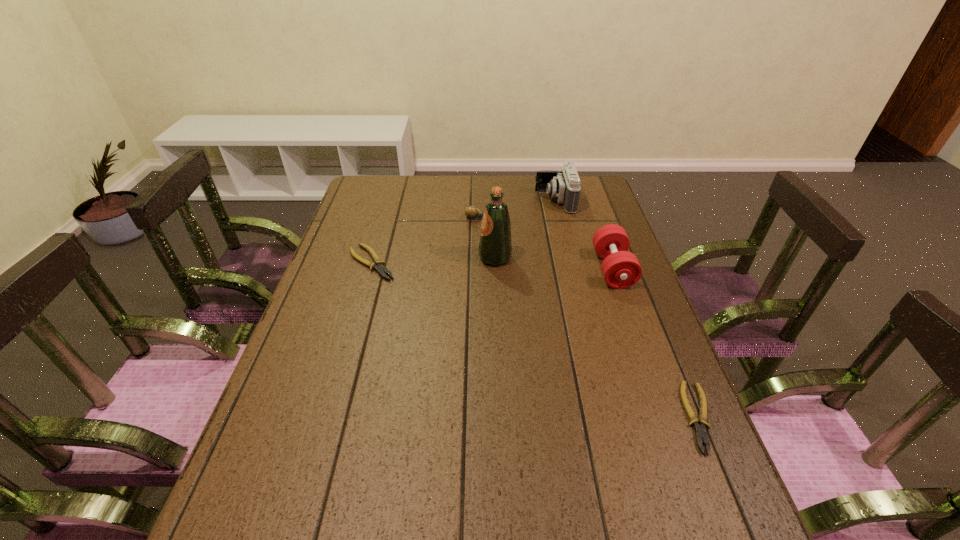
In the image, there is a desktop. At what (x,y) coordinates should I click in order to perform the action: click on free region at the right edge. Please return your answer as a coordinate pair (x, y). Looking at the image, I should click on (615, 291).

At what (x,y) coordinates should I click in order to perform the action: click on vacant space at the far left corner of the desktop. Please return your answer as a coordinate pair (x, y). Looking at the image, I should click on (363, 175).

This screenshot has height=540, width=960. What are the coordinates of `free space at the far right corner of the desktop` in the screenshot? It's located at (588, 187).

This screenshot has height=540, width=960. I want to click on vacant area between the dumbbell and the second tallest object, so click(x=584, y=235).

Identify the location of vacant region between the third tallest object and the tallest object. 554,264.

The height and width of the screenshot is (540, 960). In order to click on free space between the dumbbell and the escargot in this screenshot , I will do `click(545, 244)`.

Where is `empty space between the shorter pliers and the left pliers`? The height and width of the screenshot is (540, 960). empty space between the shorter pliers and the left pliers is located at coordinates (536, 340).

Identify the location of free point between the camera and the olive oil. The width and height of the screenshot is (960, 540). (525, 230).

Identify the location of unoccupied area between the dumbbell and the escargot. (545, 244).

This screenshot has height=540, width=960. I want to click on unoccupied position between the camera and the tallest object, so click(525, 230).